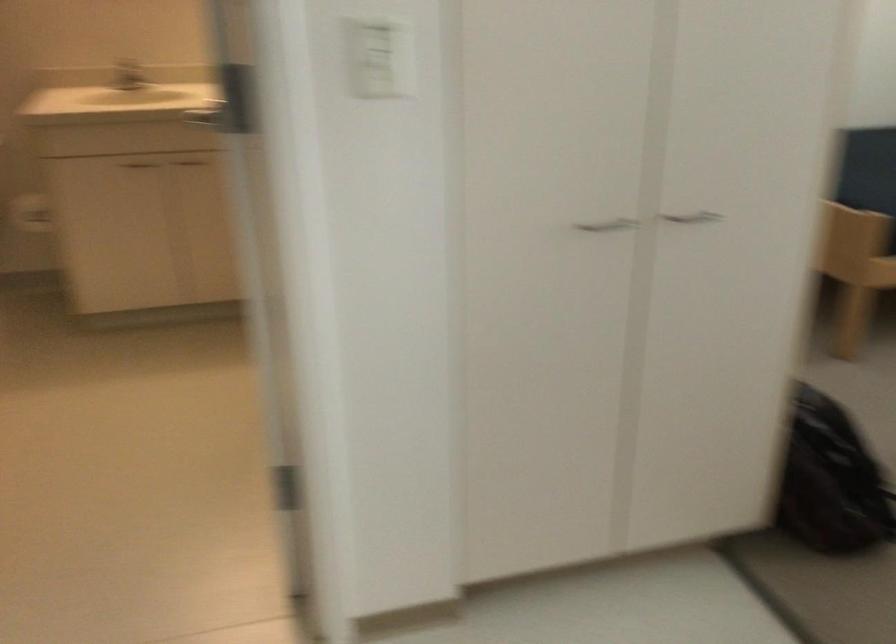
What do you see at coordinates (381, 59) in the screenshot?
I see `a white light switch` at bounding box center [381, 59].